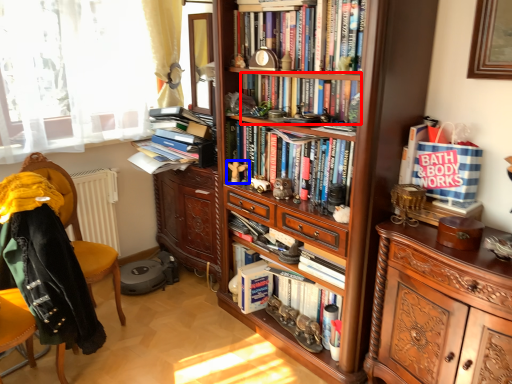
Question: Which of the following is the farthest to the observer, book (highlighted by a red box) or toy (highlighted by a blue box)?

Choices:
 (A) book
 (B) toy

Answer: (B)